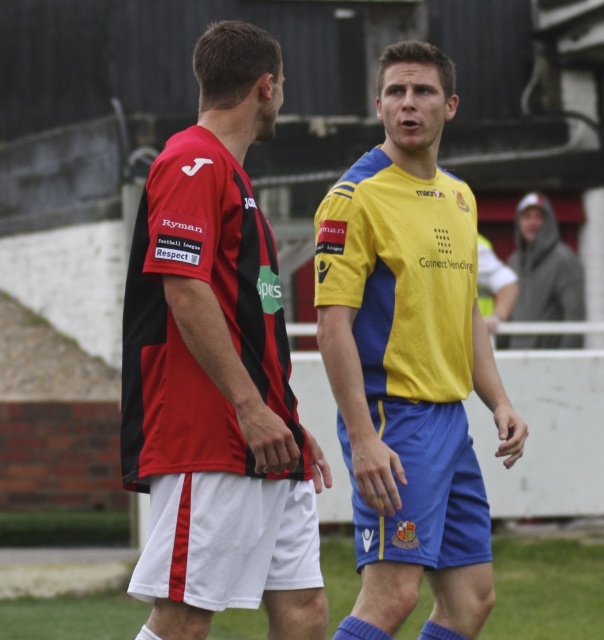
Between point (175, 266) and point (97, 604), which one is positioned in front?

Positioned in front is point (175, 266).

Identify the location of matte black and red jersey at left. This screenshot has width=604, height=640. (216, 371).

Is point (196, 579) closer to viewer compared to point (527, 237)?

Yes.

Can you confirm if matte black and red jersey at left is positioned below gray hooded jacket at upper right?

No, matte black and red jersey at left is not below gray hooded jacket at upper right.

Is point (204, 269) in front of point (528, 253)?

Yes, it is.

The image size is (604, 640). Identify the location of matte black and red jersey at left. (216, 371).

Who is lower down, green grass at lower center or gray hooded jacket at upper right?

Positioned lower is green grass at lower center.

Between point (509, 625) and point (553, 212), which one is positioned behind?

The point (553, 212) is more distant.

Is point (492, 611) closer to viewer compared to point (550, 276)?

Yes, point (492, 611) is closer to viewer.

Locate an element on the screen. This screenshot has height=640, width=604. green grass at lower center is located at coordinates (547, 588).